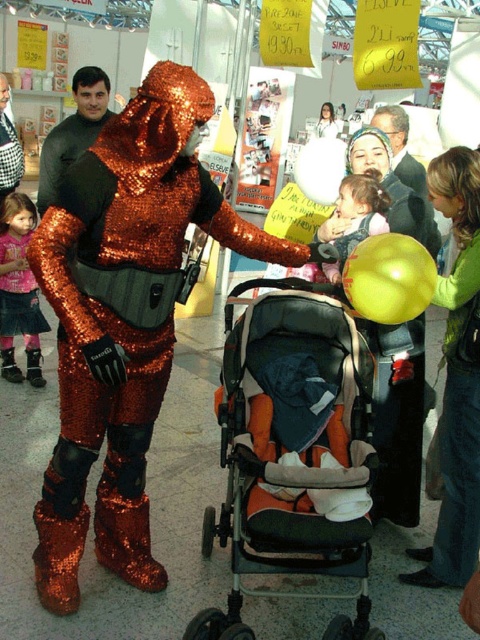
You are an event planner arranging a photo shoot in the convention hall. You need to position the matte pink shirt at lower left and the matte black jacket at upper right in the frame. Which object should be placed closer to the camera to ensure both are visible without overlapping?

The matte pink shirt at lower left should be placed closer to the camera since it is positioned under the matte black jacket at upper right, which means it is farther away. By moving the matte pink shirt forward, you can prevent overlap and ensure both are visible.

You are standing in the convention hall and want to know which of the two points, point [2,364] or point [414,157], is nearer to you. Can you determine this based on the scene?

Point [2,364] is closer to the viewer than point [414,157].